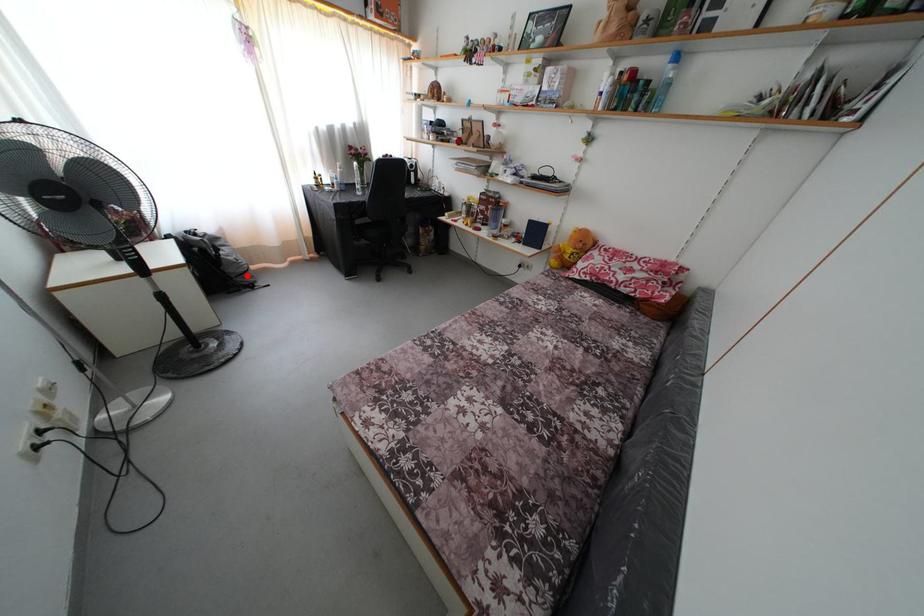
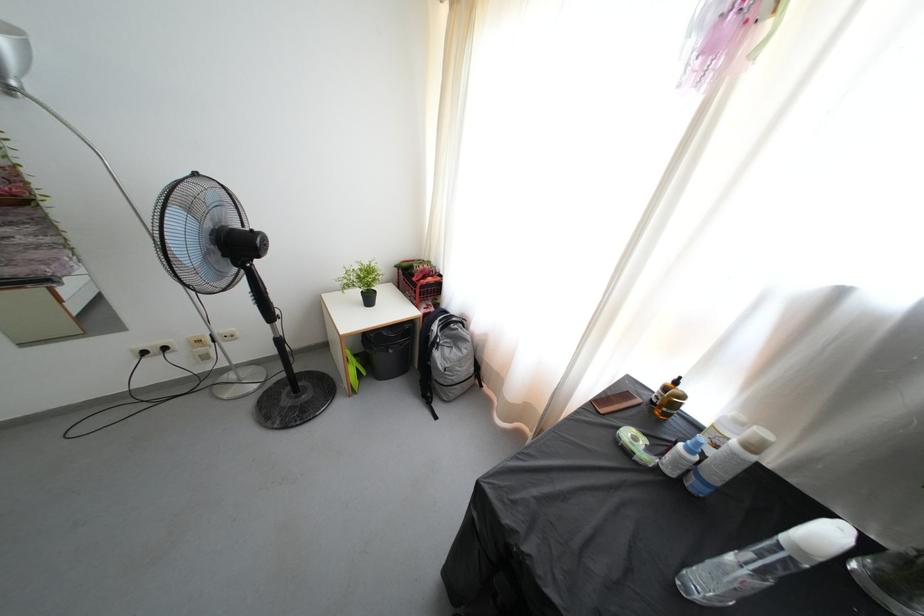
The point at the highlighted location is marked in the first image. Where is the corresponding point in the second image?

(445, 387)